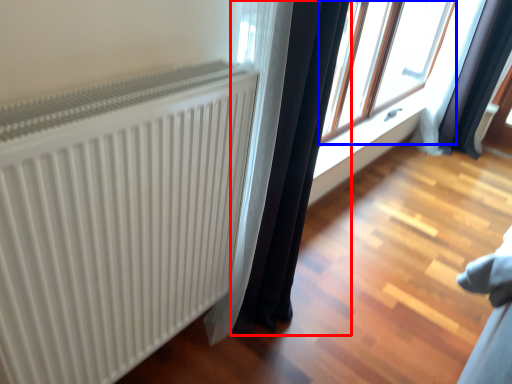
Question: Which of the following is the closest to the observer, curtain (highlighted by a red box) or window (highlighted by a blue box)?

Choices:
 (A) curtain
 (B) window

Answer: (A)